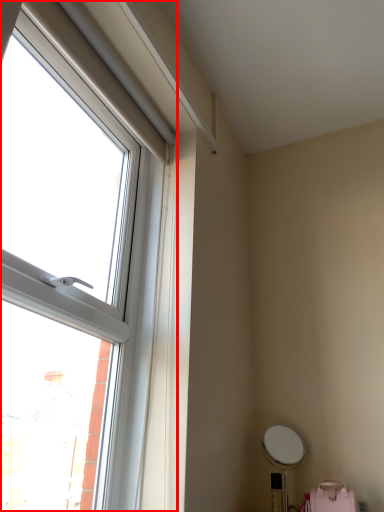
Question: From the image's perspective, where is window (annotated by the red box) located relative to swivel chair?

Choices:
 (A) above
 (B) below

Answer: (A)